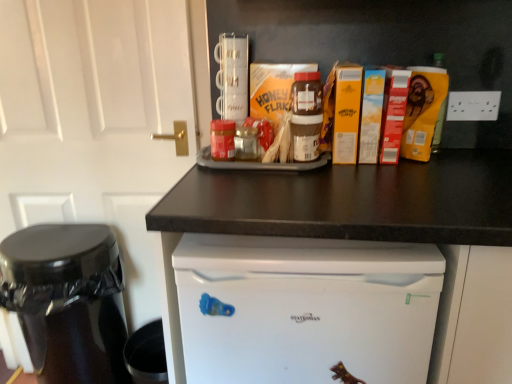
Question: From a real-world perspective, does white matte door at upper left stand above white plastic electric outlet at upper right?

Choices:
 (A) no
 (B) yes

Answer: (A)

Question: Is white matte door at upper left in front of white plastic electric outlet at upper right?

Choices:
 (A) no
 (B) yes

Answer: (B)

Question: Does white matte door at upper left have a lesser width compared to white plastic electric outlet at upper right?

Choices:
 (A) no
 (B) yes

Answer: (A)

Question: Considering the relative sizes of white matte door at upper left and white plastic electric outlet at upper right in the image provided, is white matte door at upper left taller than white plastic electric outlet at upper right?

Choices:
 (A) no
 (B) yes

Answer: (B)

Question: Is white matte door at upper left surrounding white plastic electric outlet at upper right?

Choices:
 (A) no
 (B) yes

Answer: (A)

Question: Does white matte door at upper left have a lesser height compared to white plastic electric outlet at upper right?

Choices:
 (A) no
 (B) yes

Answer: (A)

Question: Could you tell me if white matte door at upper left is turned towards dark brown laminate counter at center?

Choices:
 (A) no
 (B) yes

Answer: (A)

Question: Is dark brown laminate counter at center located within white matte door at upper left?

Choices:
 (A) no
 (B) yes

Answer: (A)

Question: Is the position of white matte door at upper left more distant than that of dark brown laminate counter at center?

Choices:
 (A) no
 (B) yes

Answer: (B)

Question: Is white matte door at upper left wider than dark brown laminate counter at center?

Choices:
 (A) no
 (B) yes

Answer: (A)

Question: Considering the relative sizes of white matte door at upper left and dark brown laminate counter at center in the image provided, is white matte door at upper left shorter than dark brown laminate counter at center?

Choices:
 (A) yes
 (B) no

Answer: (B)

Question: Considering the relative positions of white matte door at upper left and dark brown laminate counter at center in the image provided, is white matte door at upper left to the right of dark brown laminate counter at center from the viewer's perspective?

Choices:
 (A) yes
 (B) no

Answer: (B)

Question: Considering the relative sizes of shiny black coffee maker at left and white plastic electric outlet at upper right in the image provided, is shiny black coffee maker at left shorter than white plastic electric outlet at upper right?

Choices:
 (A) no
 (B) yes

Answer: (A)